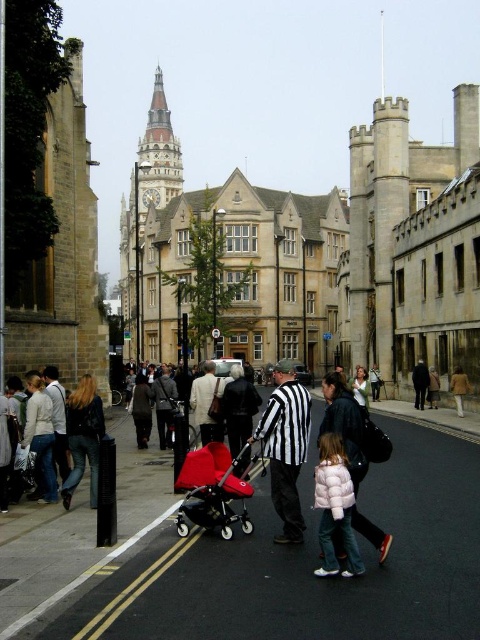
Which of these two, matte red baby carriage at center or white puffy coat at lower center, stands taller?

white puffy coat at lower center

Is matte red baby carriage at center closer to camera compared to white puffy coat at lower center?

No, it is behind white puffy coat at lower center.

Measure the distance between point (x=233, y=518) and camera.

121.87 feet

At what (x,y) coordinates should I click in order to perform the action: click on matte red baby carriage at center. Please return your answer as a coordinate pair (x, y). Looking at the image, I should click on coord(212,490).

Between smooth concrete pavement at center and white puffy coat at lower center, which one is positioned higher?

white puffy coat at lower center is above.

Is point (399, 499) positioned behind point (316, 480)?

Yes, point (399, 499) is behind point (316, 480).

The height and width of the screenshot is (640, 480). Identify the location of smooth concrete pavement at center. (253, 556).

Between smooth concrete pavement at center and matte red baby carriage at center, which one has less height?

With less height is smooth concrete pavement at center.

Which is behind, point (72, 618) or point (207, 490)?

The point (207, 490) is more distant.

Between point (302, 476) and point (191, 508), which one is positioned in front?

Point (191, 508) is more forward.

The image size is (480, 640). In order to click on smooth concrete pavement at center in this screenshot , I will do `click(253, 556)`.